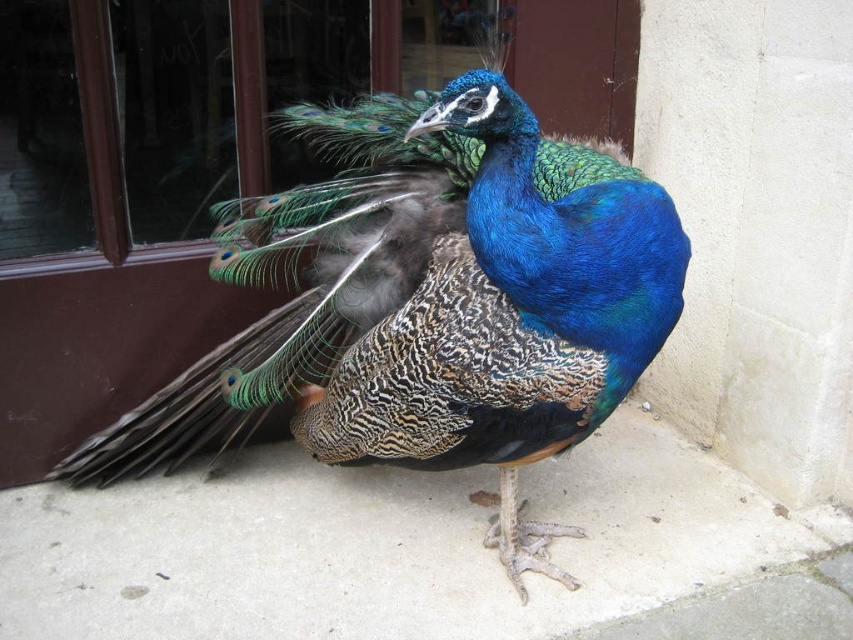
Which is behind, point (502, 476) or point (688, 589)?

The point (502, 476) is behind.

Can you confirm if shiny blue peacock at center is positioned above smooth concrete pavement at lower center?

Yes.

Is point (445, 237) closer to camera compared to point (592, 602)?

Yes, point (445, 237) is closer to viewer.

Image resolution: width=853 pixels, height=640 pixels. Identify the location of shiny blue peacock at center. (434, 300).